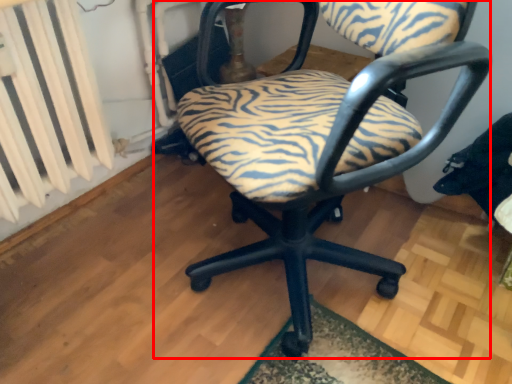
Question: Where is chair (annotated by the red box) located in relation to radiator in the image?

Choices:
 (A) left
 (B) right

Answer: (B)